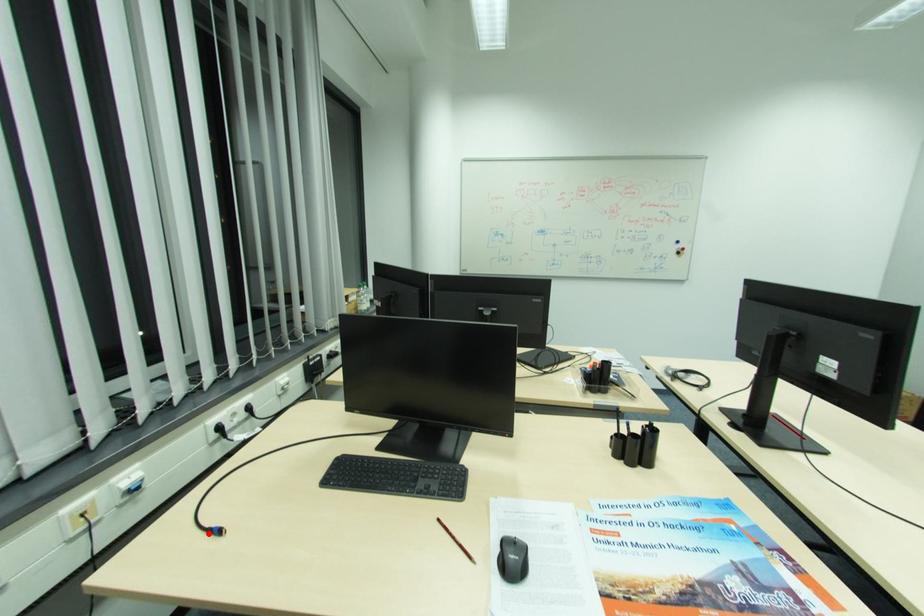
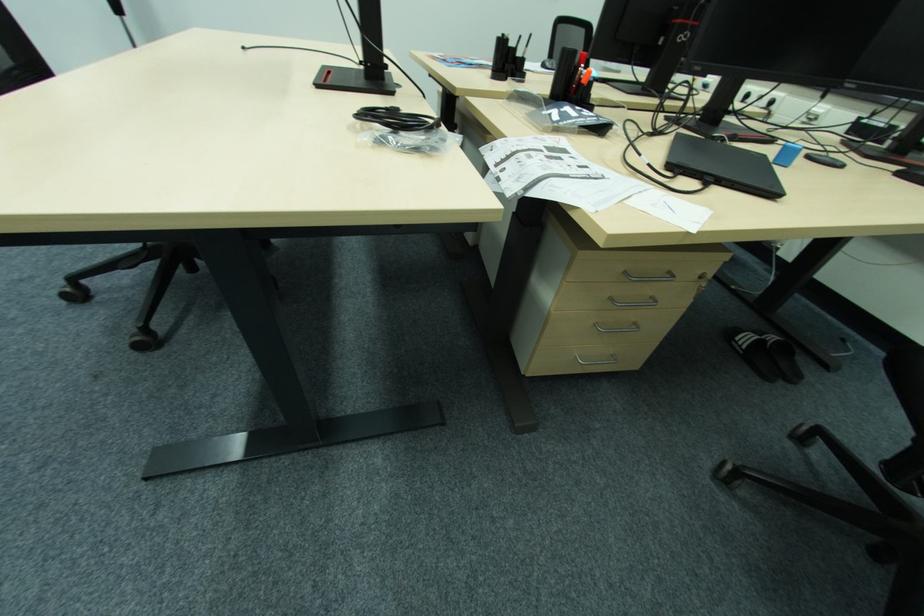
Question: I am providing you with two images of the same scene from different viewpoints. A red point is marked on the first image. Is the red point's position out of view in image 2?

Choices:
 (A) Yes
 (B) No

Answer: (A)